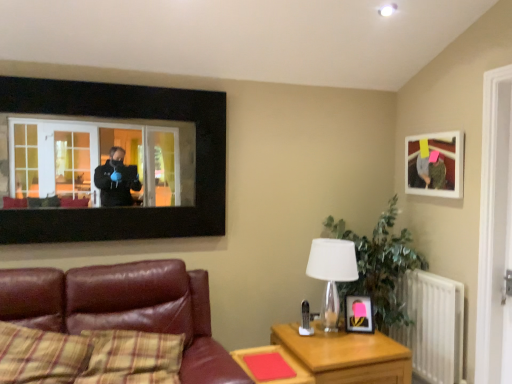
The image size is (512, 384). Find the location of `free space on the front side of matte black picture frame at center, the first picture frame viewed from the left`. free space on the front side of matte black picture frame at center, the first picture frame viewed from the left is located at coordinates (360, 342).